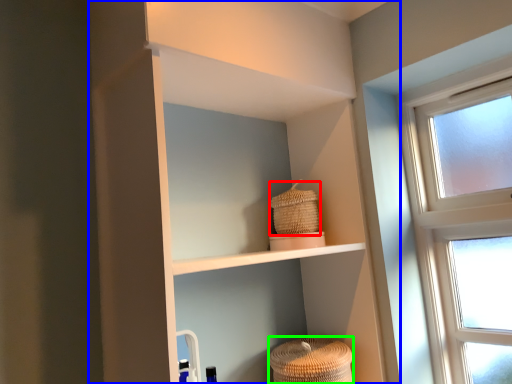
Question: Which is nearer to the basket (highlighted by a red box)? shelf (highlighted by a blue box) or basket (highlighted by a green box).

Choices:
 (A) shelf
 (B) basket

Answer: (B)